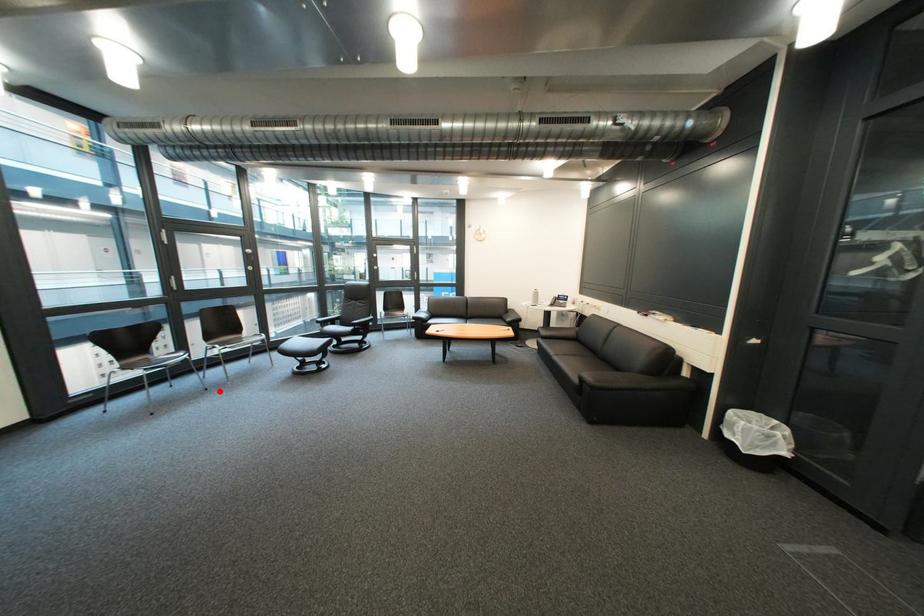
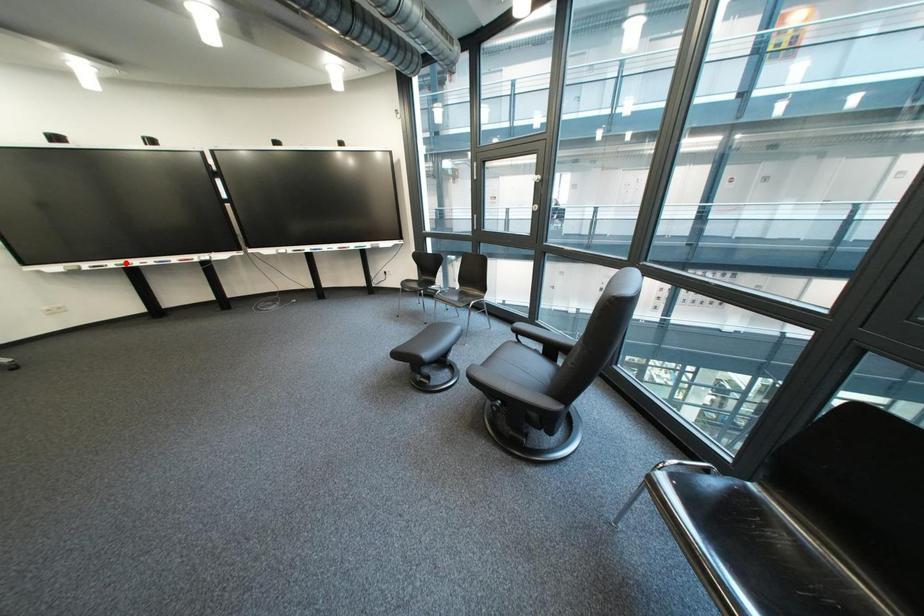
I am providing you with two images of the same scene from different viewpoints. A red point is marked on the first image and another point is marked on the second image. Do the highlighted points in image1 and image2 indicate the same real-world spot?

No